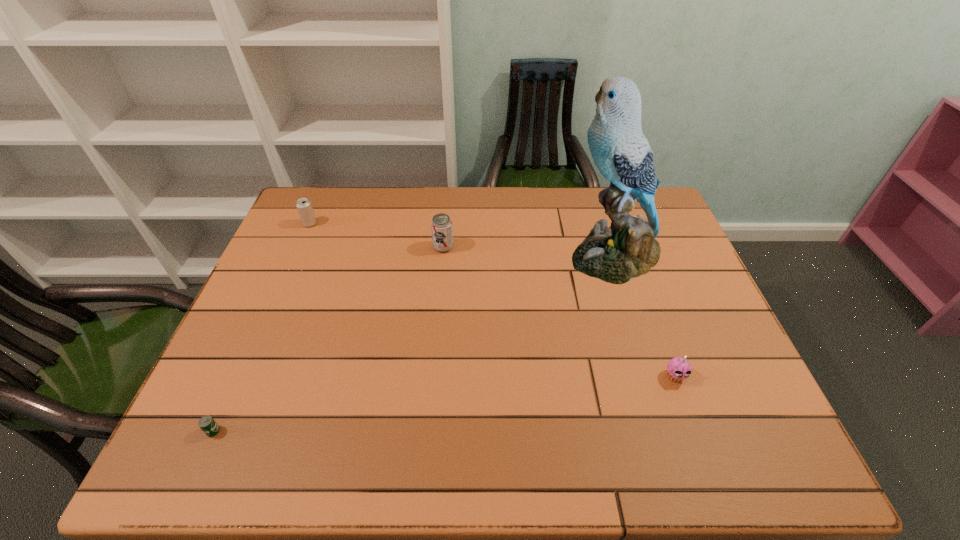
Identify the location of beer can identified as the closest to the second nearest object. (441, 225).

Identify the location of the closest beer can to the farthest object. The width and height of the screenshot is (960, 540). (441, 225).